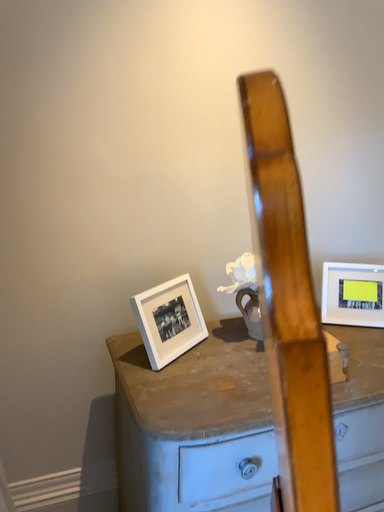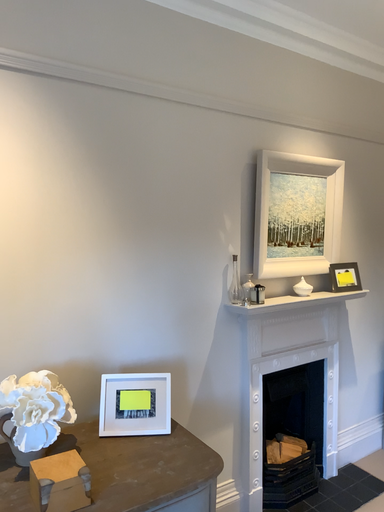
Question: How did the camera likely rotate when shooting the video?

Choices:
 (A) rotated right
 (B) rotated left

Answer: (A)